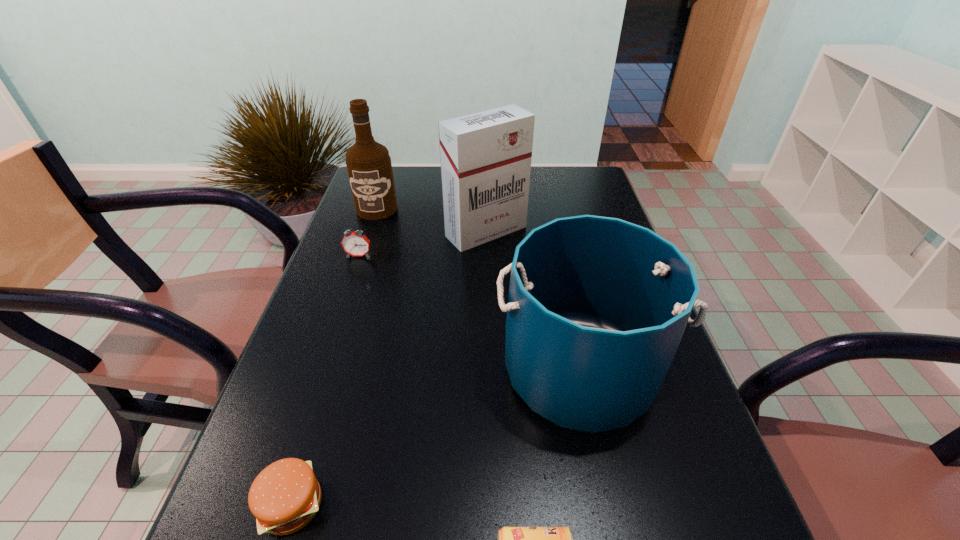
You are a GUI agent. You are given a task and a screenshot of the screen. Output one action in this format:
    pyautogui.click(x=<x>, y=<y>)
    Task: Click on the vacant space in between the third shortest object and the alcohol
    This screenshot has width=960, height=540.
    Given the screenshot: What is the action you would take?
    pyautogui.click(x=368, y=232)

Image resolution: width=960 pixels, height=540 pixels. Find the location of `unoccupied position between the cigarette case and the alarm clock`. unoccupied position between the cigarette case and the alarm clock is located at coordinates (422, 244).

I want to click on object that is the fifth closest to the fourth tallest object, so click(509, 539).

Choose which object is the fifth nearest neighbor to the alarm clock. Please provide its 2D coordinates. Your answer should be formatted as a tuple, i.e. [(x, y)], where the tuple contains the x and y coordinates of a point satisfying the conditions above.

[(509, 539)]

In order to click on free space that satisfies the following two spatial constraints: 1. on the label of the cigarette case; 2. on the left side of the alcohol in this screenshot , I will do `click(370, 232)`.

Where is `vacant space that satisfies the following two spatial constraints: 1. on the clock face of the third shortest object; 2. on the right side of the bucket`? The height and width of the screenshot is (540, 960). vacant space that satisfies the following two spatial constraints: 1. on the clock face of the third shortest object; 2. on the right side of the bucket is located at coordinates (321, 370).

You are a GUI agent. You are given a task and a screenshot of the screen. Output one action in this format:
    pyautogui.click(x=<x>, y=<y>)
    Task: Click on the vacant point that satisfies the following two spatial constraints: 1. on the clock face of the fourth tallest object; 2. on the left side of the bucket
    This screenshot has height=540, width=960.
    Given the screenshot: What is the action you would take?
    pyautogui.click(x=321, y=370)

Where is `vacant space that satisfies the following two spatial constraints: 1. on the label of the cigarette case; 2. on the right side of the alcohol`? Image resolution: width=960 pixels, height=540 pixels. vacant space that satisfies the following two spatial constraints: 1. on the label of the cigarette case; 2. on the right side of the alcohol is located at coordinates (370, 232).